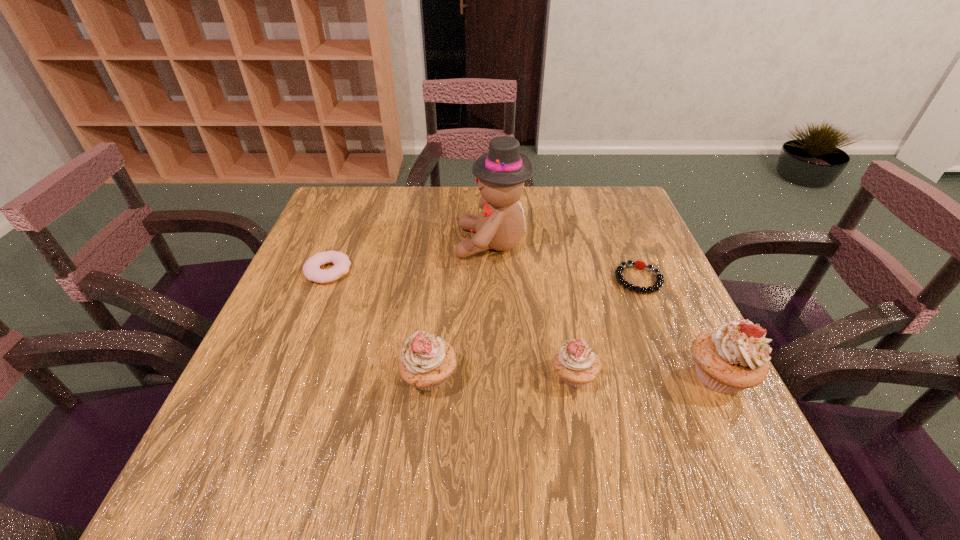
This screenshot has height=540, width=960. Find the location of `vacant space located 0.310m on the back of the fourth shortest object`. vacant space located 0.310m on the back of the fourth shortest object is located at coordinates (442, 258).

You are a GUI agent. You are given a task and a screenshot of the screen. Output one action in this format:
    pyautogui.click(x=<x>, y=<y>)
    Task: Click on the vacant space located 0.350m on the left of the second cupcake from left to right
    The height and width of the screenshot is (540, 960).
    Given the screenshot: What is the action you would take?
    pyautogui.click(x=368, y=376)

Where is `vacant area situated 0.350m on the left of the tallest cupcake`? The image size is (960, 540). vacant area situated 0.350m on the left of the tallest cupcake is located at coordinates (500, 375).

Where is `vacant space located on the front-facing side of the rag_doll`? The height and width of the screenshot is (540, 960). vacant space located on the front-facing side of the rag_doll is located at coordinates (308, 243).

I want to click on free location located on the front-facing side of the rag_doll, so [434, 243].

Where is `vacant area situated 0.220m on the front-facing side of the rag_doll`? The image size is (960, 540). vacant area situated 0.220m on the front-facing side of the rag_doll is located at coordinates (372, 243).

This screenshot has height=540, width=960. Identify the location of blank area located 0.110m on the left of the bracelet. (568, 279).

The width and height of the screenshot is (960, 540). In order to click on free space located on the back of the doughnut in this screenshot , I will do point(343,234).

Identify the location of object situated at the far edge. This screenshot has height=540, width=960. (501, 172).

Find the location of a particular element. object situated at the left edge is located at coordinates (311, 269).